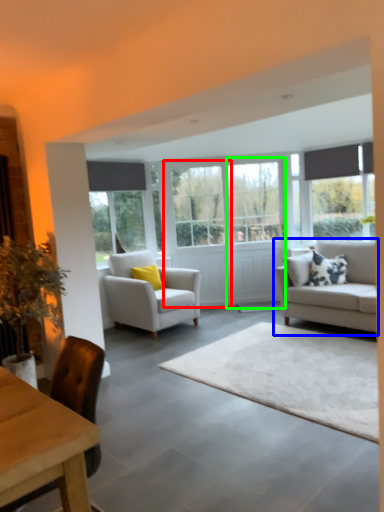
Question: Considering the real-world distances, which object is closest to glass door (highlighted by a red box)? studio couch (highlighted by a blue box) or glass door (highlighted by a green box).

Choices:
 (A) studio couch
 (B) glass door

Answer: (B)